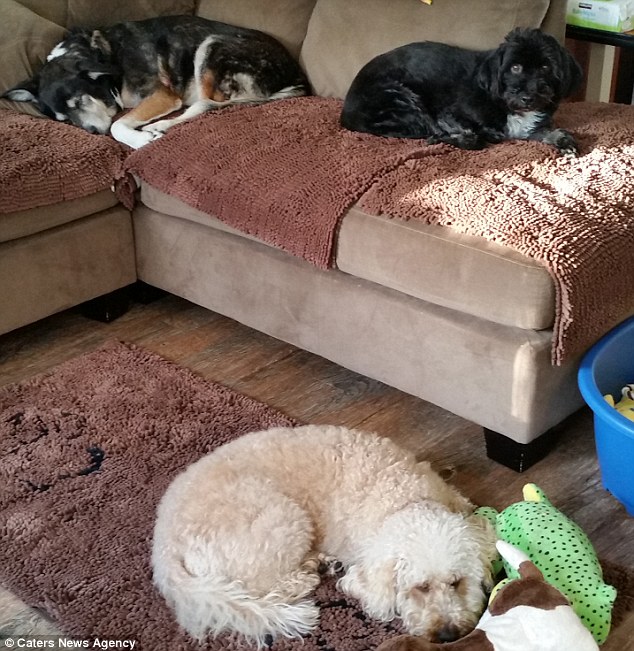
The width and height of the screenshot is (634, 651). Identify the location of couch. (252, 270), (52, 279).